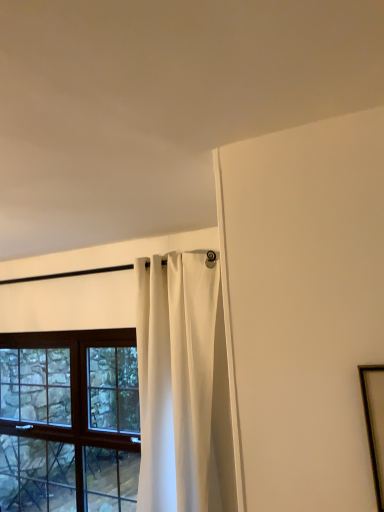
Locate an element on the screen. white matte curtain at upper center is located at coordinates (175, 378).

Describe the element at coordinates (69, 421) in the screenshot. I see `wooden-framed window at left` at that location.

The width and height of the screenshot is (384, 512). In order to click on white matte curtain at upper center in this screenshot , I will do click(175, 378).

Is point (45, 466) positioned after point (367, 395)?

Yes, point (45, 466) is behind point (367, 395).

Locate an element on the screen. The width and height of the screenshot is (384, 512). picture frame that is on the right side of wooden-framed window at left is located at coordinates (374, 422).

From a real-world perspective, is wooden-framed window at left on wooden picture frame at right?

No, from a real-world perspective, wooden-framed window at left is not over wooden picture frame at right

Is wooden-framed window at left in front of or behind wooden picture frame at right in the image?

wooden-framed window at left is behind wooden picture frame at right.

Considering the sizes of white matte curtain at upper center and wooden picture frame at right in the image, is white matte curtain at upper center wider or thinner than wooden picture frame at right?

Clearly, white matte curtain at upper center has more width compared to wooden picture frame at right.

How far apart are white matte curtain at upper center and wooden picture frame at right?

white matte curtain at upper center and wooden picture frame at right are 1.45 meters apart from each other.

Is white matte curtain at upper center in front of or behind wooden picture frame at right in the image?

In the image, white matte curtain at upper center appears behind wooden picture frame at right.

The image size is (384, 512). I want to click on window that is behind the white matte curtain at upper center, so click(x=69, y=421).

From the image's perspective, which one is positioned higher, wooden-framed window at left or white matte curtain at upper center?

white matte curtain at upper center appears higher in the image.

Considering the relative positions of wooden-framed window at left and white matte curtain at upper center in the image provided, is wooden-framed window at left to the right of white matte curtain at upper center from the viewer's perspective?

No, wooden-framed window at left is not to the right of white matte curtain at upper center.

Is wooden-framed window at left spatially inside white matte curtain at upper center, or outside of it?

The correct answer is: outside.

Does wooden picture frame at right touch white matte curtain at upper center?

No, wooden picture frame at right is not in contact with white matte curtain at upper center.

Which is behind, point (377, 438) or point (180, 315)?

The point (180, 315) is behind.

Between wooden picture frame at right and white matte curtain at upper center, which one has smaller width?

wooden picture frame at right is thinner.

Is wooden picture frame at right taller or shorter than white matte curtain at upper center?

Clearly, wooden picture frame at right is shorter compared to white matte curtain at upper center.

From the image's perspective, between wooden picture frame at right and wooden-framed window at left, who is located below?

wooden-framed window at left is shown below in the image.

Does point (377, 431) come in front of point (112, 386)?

That is True.

Could you tell me if wooden picture frame at right is facing wooden-framed window at left?

No, wooden picture frame at right does not turn towards wooden-framed window at left.

Looking at their sizes, would you say white matte curtain at upper center is wider or thinner than wooden-framed window at left?

Considering their sizes, white matte curtain at upper center looks broader than wooden-framed window at left.

Is white matte curtain at upper center situated inside wooden-framed window at left or outside?

white matte curtain at upper center is outside wooden-framed window at left.

Locate an element on the screen. This screenshot has width=384, height=512. window behind the white matte curtain at upper center is located at coordinates (69, 421).

Considering their positions, is white matte curtain at upper center located in front of or behind wooden-framed window at left?

white matte curtain at upper center is positioned closer to the viewer than wooden-framed window at left.

Locate an element on the screen. The image size is (384, 512). window that appears behind the wooden picture frame at right is located at coordinates (69, 421).

Locate an element on the screen. curtain below the wooden picture frame at right (from a real-world perspective) is located at coordinates (175, 378).

From the image, which object appears to be farther from white matte curtain at upper center, wooden-framed window at left or wooden picture frame at right?

wooden picture frame at right lies further to white matte curtain at upper center than the other object.

Based on the photo, when comparing their distances from wooden picture frame at right, does white matte curtain at upper center or wooden-framed window at left seem closer?

white matte curtain at upper center lies closer to wooden picture frame at right than the other object.

Looking at the image, which one is located closer to white matte curtain at upper center, wooden picture frame at right or wooden-framed window at left?

wooden-framed window at left.

When comparing their distances from wooden-framed window at left, does wooden picture frame at right or white matte curtain at upper center seem further?

wooden picture frame at right is further to wooden-framed window at left.

From the image, which object appears to be nearer to wooden picture frame at right, wooden-framed window at left or white matte curtain at upper center?

white matte curtain at upper center is positioned closer to the anchor wooden picture frame at right.

Based on their spatial positions, is white matte curtain at upper center or wooden picture frame at right closer to wooden-framed window at left?

The object closer to wooden-framed window at left is white matte curtain at upper center.

Find the location of a particular element. The height and width of the screenshot is (512, 384). curtain positioned between wooden picture frame at right and wooden-framed window at left from near to far is located at coordinates (175, 378).